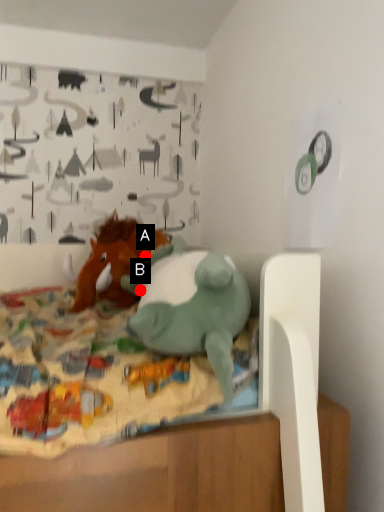
Question: Two points are circled on the image, labeled by A and B beside each circle. Which point appears farthest from the camera in this image?

Choices:
 (A) A is further
 (B) B is further

Answer: (A)